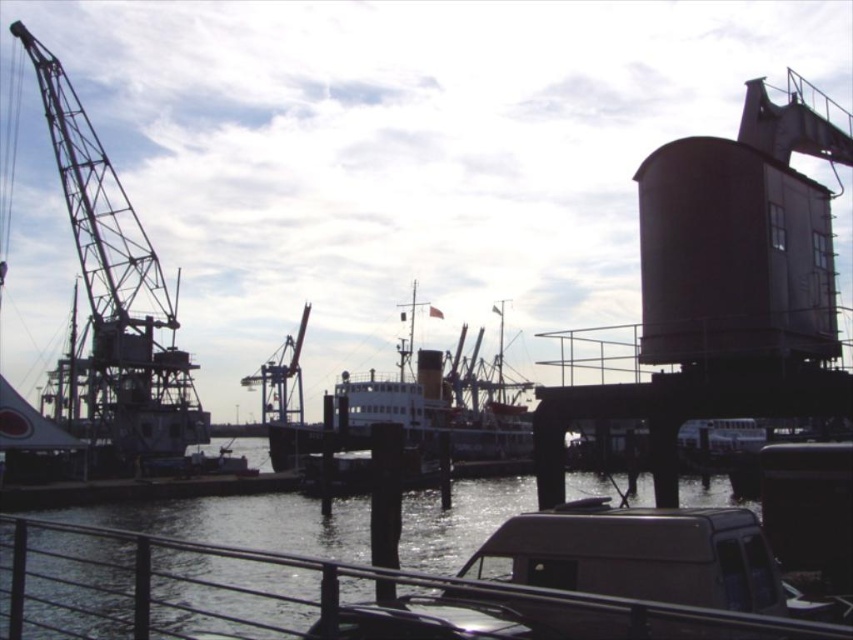
Is clear water at lower center thinner than metallic industrial crane at center?

In fact, clear water at lower center might be wider than metallic industrial crane at center.

Can you confirm if clear water at lower center is smaller than metallic industrial crane at center?

Actually, clear water at lower center might be larger than metallic industrial crane at center.

The width and height of the screenshot is (853, 640). In order to click on clear water at lower center in this screenshot , I will do (x=241, y=522).

Looking at this image, can you confirm if metallic industrial crane at left is positioned above white matte ship at center?

Indeed, metallic industrial crane at left is positioned over white matte ship at center.

Is point (62, 122) positioned after point (351, 433)?

That is False.

The width and height of the screenshot is (853, 640). Describe the element at coordinates (113, 301) in the screenshot. I see `metallic industrial crane at left` at that location.

Image resolution: width=853 pixels, height=640 pixels. Identify the location of metallic industrial crane at left. (113, 301).

Who is more distant from viewer, (170, 312) or (262, 396)?

The point (262, 396) is more distant.

This screenshot has height=640, width=853. What do you see at coordinates (113, 301) in the screenshot?
I see `metallic industrial crane at left` at bounding box center [113, 301].

Which is in front, point (85, 394) or point (291, 400)?

Point (85, 394)

The height and width of the screenshot is (640, 853). Identify the location of metallic industrial crane at left. (113, 301).